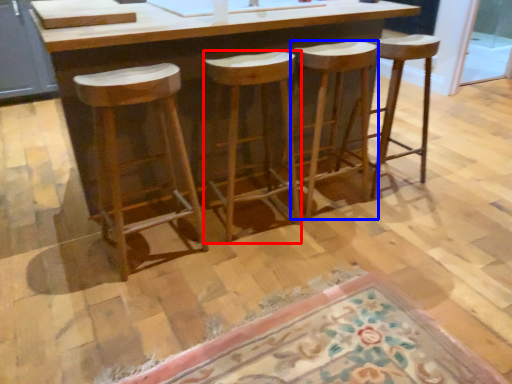
Question: Which point is closer to the camera, stool (highlighted by a red box) or stool (highlighted by a blue box)?

Choices:
 (A) stool
 (B) stool

Answer: (A)